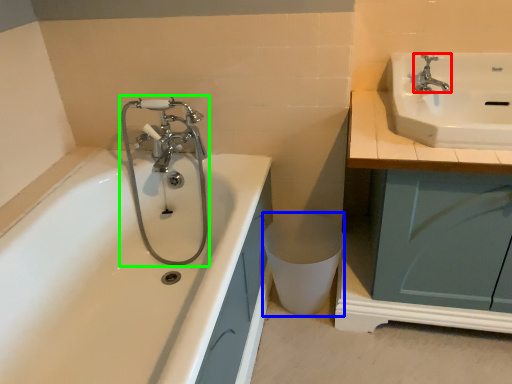
Question: Considering the real-world distances, which object is farthest from tap (highlighted by a red box)? toilet bowl (highlighted by a blue box) or plumbing fixture (highlighted by a green box)?

Choices:
 (A) toilet bowl
 (B) plumbing fixture

Answer: (B)